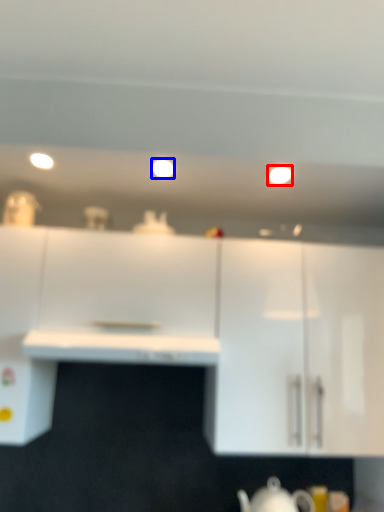
Question: Which of the following is the farthest to the observer, lighting (highlighted by a red box) or lighting (highlighted by a blue box)?

Choices:
 (A) lighting
 (B) lighting

Answer: (A)